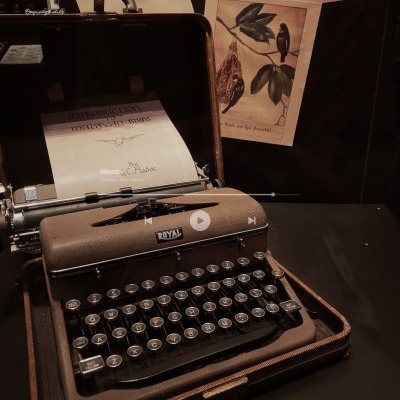
Identify the location of k key on the typewriter. (225, 301).